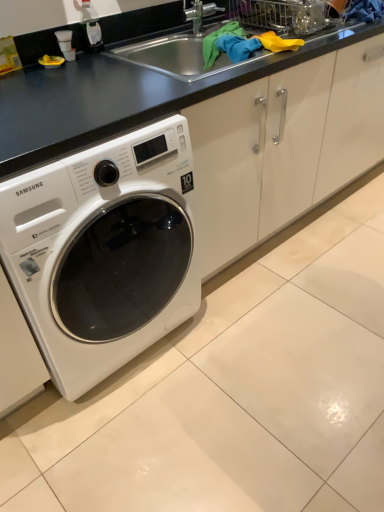
The image size is (384, 512). What do you see at coordinates (90, 28) in the screenshot?
I see `clear plastic bottle at upper left` at bounding box center [90, 28].

Where is `white glossy washing machine at lower left`? white glossy washing machine at lower left is located at coordinates (104, 251).

From a real-world perspective, which object rests below the other?

From a 3D spatial view, white glossy washing machine at lower left is below.

From the image's perspective, between white glossy washing machine at lower left and clear plastic bottle at upper left, who is located below?

From the image's view, white glossy washing machine at lower left is below.

Is white glossy washing machine at lower left positioned with its back to clear plastic bottle at upper left?

No, white glossy washing machine at lower left is not facing the opposite direction of clear plastic bottle at upper left.

Can you confirm if white glossy washing machine at lower left is wider than clear plastic bottle at upper left?

Yes, white glossy washing machine at lower left is wider than clear plastic bottle at upper left.

Consider the image. Considering the relative sizes of clear plastic bottle at upper left and white glossy washing machine at lower left in the image provided, is clear plastic bottle at upper left smaller than white glossy washing machine at lower left?

Correct, clear plastic bottle at upper left occupies less space than white glossy washing machine at lower left.

Visually, is clear plastic bottle at upper left positioned to the left or to the right of white glossy washing machine at lower left?

From the image, it's evident that clear plastic bottle at upper left is to the right of white glossy washing machine at lower left.

From their relative heights in the image, would you say clear plastic bottle at upper left is taller or shorter than white glossy washing machine at lower left?

Considering their sizes, clear plastic bottle at upper left has less height than white glossy washing machine at lower left.

From a real-world perspective, is clear plastic bottle at upper left located beneath black matte counter top at upper center?

Incorrect, from a real-world perspective, clear plastic bottle at upper left is higher than black matte counter top at upper center.

How much distance is there between clear plastic bottle at upper left and black matte counter top at upper center?

clear plastic bottle at upper left and black matte counter top at upper center are 16.53 inches apart from each other.

Is clear plastic bottle at upper left looking in the opposite direction of black matte counter top at upper center?

clear plastic bottle at upper left is not turned away from black matte counter top at upper center.

Considering the relative sizes of clear plastic bottle at upper left and black matte counter top at upper center in the image provided, is clear plastic bottle at upper left bigger than black matte counter top at upper center?

Actually, clear plastic bottle at upper left might be smaller than black matte counter top at upper center.

Is black matte counter top at upper center wider than white glossy washing machine at lower left?

In fact, black matte counter top at upper center might be narrower than white glossy washing machine at lower left.

From a real-world perspective, is black matte counter top at upper center physically above white glossy washing machine at lower left?

Yes.

Where is `counter top that appears above the white glossy washing machine at lower left (from a real-world perspective)`? counter top that appears above the white glossy washing machine at lower left (from a real-world perspective) is located at coordinates (114, 96).

From a real-world perspective, is white glossy washing machine at lower left physically below black matte counter top at upper center?

Yes, from a real-world perspective, white glossy washing machine at lower left is beneath black matte counter top at upper center.

The width and height of the screenshot is (384, 512). I want to click on counter top behind the white glossy washing machine at lower left, so click(x=114, y=96).

Is white glossy washing machine at lower left shorter than black matte counter top at upper center?

No.

Is point (44, 128) positioned in front of point (95, 22)?

Yes, point (44, 128) is in front of point (95, 22).

Is black matte counter top at upper center situated inside clear plastic bottle at upper left or outside?

black matte counter top at upper center cannot be found inside clear plastic bottle at upper left.

Is black matte counter top at upper center next to clear plastic bottle at upper left?

No, black matte counter top at upper center is not touching clear plastic bottle at upper left.

The height and width of the screenshot is (512, 384). I want to click on bottle above the white glossy washing machine at lower left (from a real-world perspective), so click(90, 28).

This screenshot has height=512, width=384. Identify the location of bottle located above the white glossy washing machine at lower left (from the image's perspective). coord(90,28).

Based on their spatial positions, is black matte counter top at upper center or white glossy washing machine at lower left further from clear plastic bottle at upper left?

white glossy washing machine at lower left.

Estimate the real-world distances between objects in this image. Which object is closer to white glossy washing machine at lower left, clear plastic bottle at upper left or black matte counter top at upper center?

Based on the image, black matte counter top at upper center appears to be nearer to white glossy washing machine at lower left.

Looking at this image, which object lies nearer to the anchor point clear plastic bottle at upper left, white glossy washing machine at lower left or black matte counter top at upper center?

The object closer to clear plastic bottle at upper left is black matte counter top at upper center.

Based on their spatial positions, is black matte counter top at upper center or clear plastic bottle at upper left closer to white glossy washing machine at lower left?

black matte counter top at upper center.

Estimate the real-world distances between objects in this image. Which object is further from black matte counter top at upper center, white glossy washing machine at lower left or clear plastic bottle at upper left?

→ The object further to black matte counter top at upper center is clear plastic bottle at upper left.

Estimate the real-world distances between objects in this image. Which object is further from black matte counter top at upper center, clear plastic bottle at upper left or white glossy washing machine at lower left?

The object further to black matte counter top at upper center is clear plastic bottle at upper left.

This screenshot has height=512, width=384. What are the coordinates of `bottle between black matte counter top at upper center and white glossy washing machine at lower left in the vertical direction` in the screenshot? It's located at (90, 28).